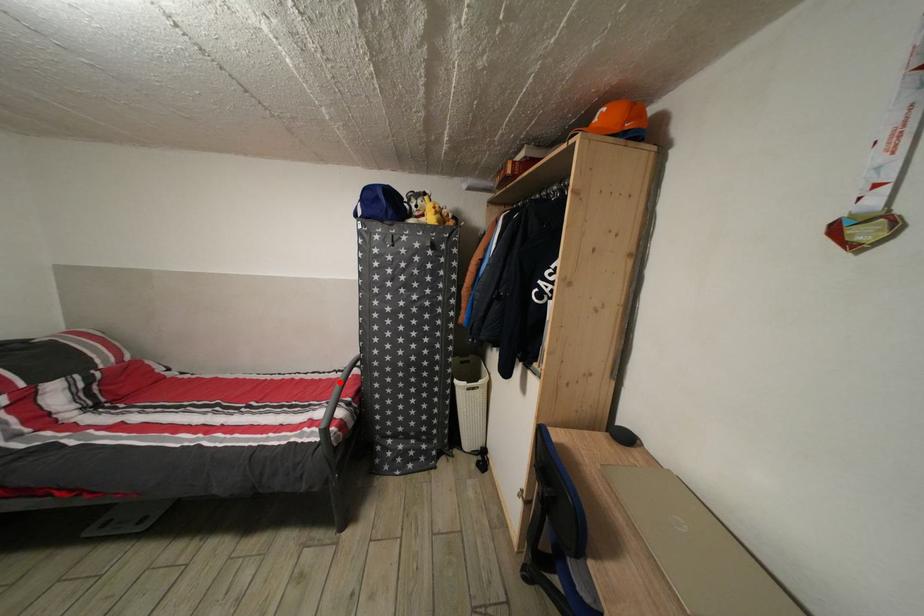
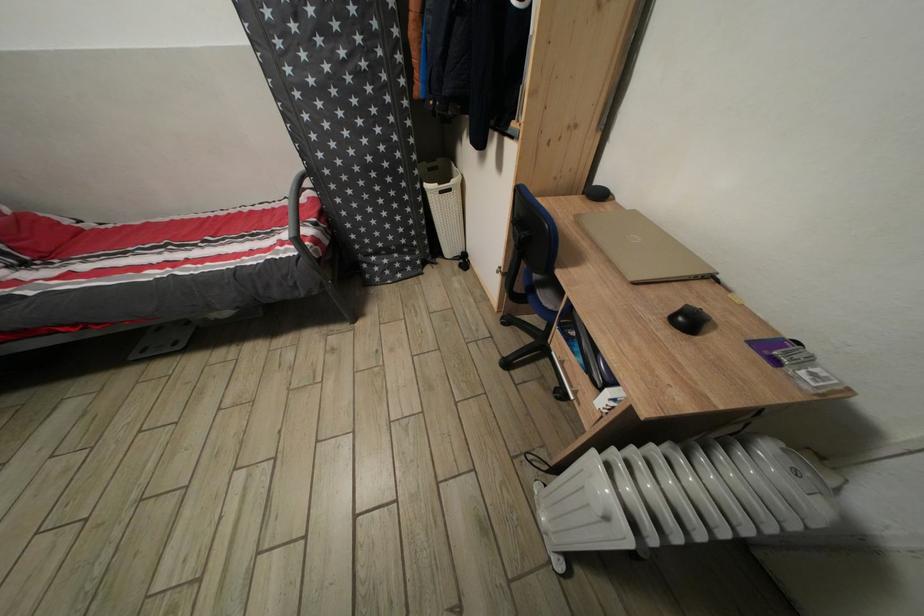
Question: A red point is marked in image1. In image2, is the corresponding 3D point closer to the camera or farther? Reply with the corresponding letter.

Choices:
 (A) The corresponding 3D point is closer.
 (B) The corresponding 3D point is farther.

Answer: (A)